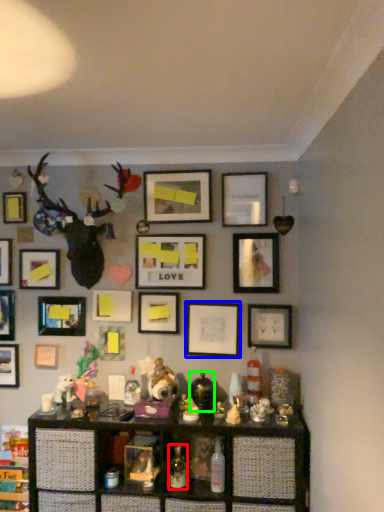
Question: Which object is positioned closest to bottle (highlighted by a red box)? Select from picture frame (highlighted by a blue box) and toy (highlighted by a green box).

Choices:
 (A) picture frame
 (B) toy

Answer: (B)